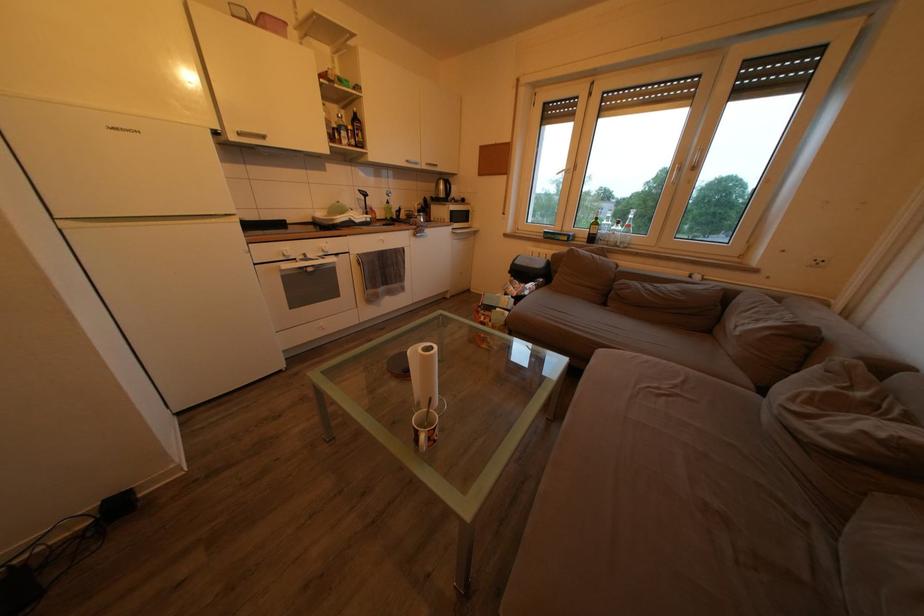
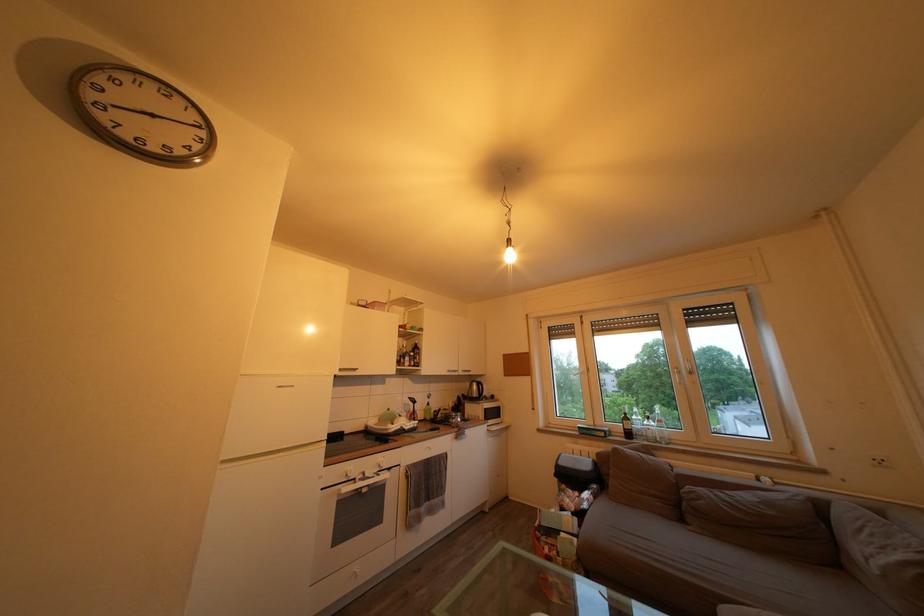
Find the pixel in the second image that matches point (827, 269) in the first image.

(889, 468)